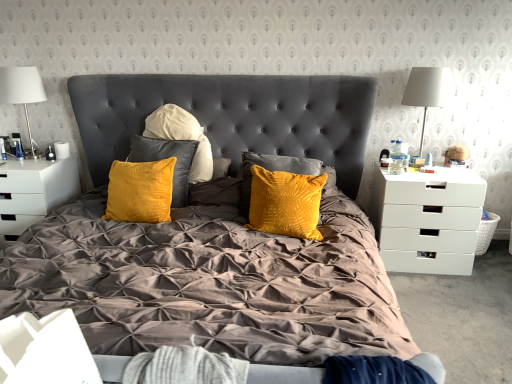
Question: Is white fabric lampshade at right, positioned as the 2th lamp in left-to-right order, to the right of white wicker picnic basket at right from the viewer's perspective?

Choices:
 (A) yes
 (B) no

Answer: (B)

Question: Is the depth of white fabric lampshade at right, the first lamp positioned from the right, greater than that of white wicker picnic basket at right?

Choices:
 (A) yes
 (B) no

Answer: (B)

Question: Is white fabric lampshade at right, positioned as the 2th lamp in left-to-right order, shorter than white wicker picnic basket at right?

Choices:
 (A) yes
 (B) no

Answer: (B)

Question: From the image's perspective, is white fabric lampshade at right, the first lamp positioned from the right, located above white wicker picnic basket at right?

Choices:
 (A) no
 (B) yes

Answer: (B)

Question: From a real-world perspective, does white fabric lampshade at right, positioned as the 2th lamp in left-to-right order, sit lower than white wicker picnic basket at right?

Choices:
 (A) yes
 (B) no

Answer: (B)

Question: Is white wicker picnic basket at right completely or partially inside white fabric lampshade at right, positioned as the 2th lamp in left-to-right order?

Choices:
 (A) yes
 (B) no

Answer: (B)

Question: Does white fabric at lower left have a smaller size compared to clear plastic bottle at right side?

Choices:
 (A) yes
 (B) no

Answer: (B)

Question: Does white fabric at lower left turn towards clear plastic bottle at right side?

Choices:
 (A) no
 (B) yes

Answer: (A)

Question: From the image's perspective, is white fabric at lower left located beneath clear plastic bottle at right side?

Choices:
 (A) no
 (B) yes

Answer: (B)

Question: Does white fabric at lower left have a greater width compared to clear plastic bottle at right side?

Choices:
 (A) no
 (B) yes

Answer: (B)

Question: Is white fabric at lower left positioned behind clear plastic bottle at right side?

Choices:
 (A) yes
 (B) no

Answer: (B)

Question: Considering the relative positions of white fabric at lower left and clear plastic bottle at right side in the image provided, is white fabric at lower left to the left of clear plastic bottle at right side from the viewer's perspective?

Choices:
 (A) yes
 (B) no

Answer: (A)

Question: From the image's perspective, would you say white fabric lampshade at right, the first lamp positioned from the right, is shown under white matte drawer at right, acting as the 2th nightstand starting from the left?

Choices:
 (A) yes
 (B) no

Answer: (B)